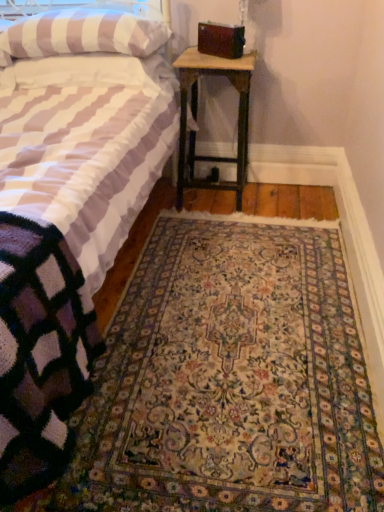
Question: Visually, is wooden nightstand at lower right positioned to the left or to the right of striped fabric pillow at upper left?

Choices:
 (A) left
 (B) right

Answer: (B)

Question: Is wooden nightstand at lower right taller or shorter than striped fabric pillow at upper left?

Choices:
 (A) short
 (B) tall

Answer: (B)

Question: Which object is the closest to the wooden nightstand at lower right?

Choices:
 (A) carpeted rug at center
 (B) striped fabric pillow at upper left
 (C) striped fabric bed at center

Answer: (B)

Question: Considering the real-world distances, which object is closest to the striped fabric bed at center?

Choices:
 (A) wooden nightstand at lower right
 (B) striped fabric pillow at upper left
 (C) carpeted rug at center

Answer: (B)